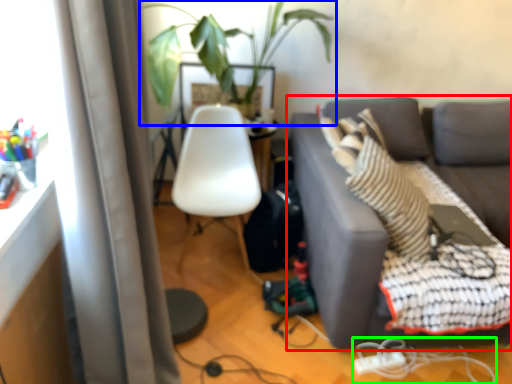
Question: Estimate the real-world distances between objects in this image. Which object is farther from studio couch (highlighted by a red box), houseplant (highlighted by a blue box) or cable (highlighted by a green box)?

Choices:
 (A) houseplant
 (B) cable

Answer: (A)